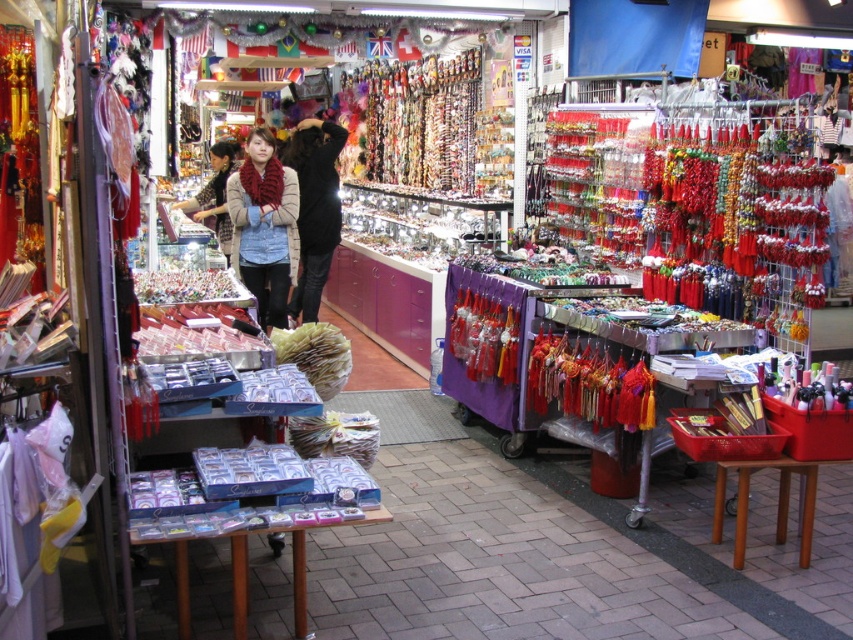
How distant is knitted red scarf at center from velvet scarf at center?

They are 38.79 inches apart.

Can you confirm if knitted red scarf at center is taller than velvet scarf at center?

Incorrect, knitted red scarf at center's height is not larger of velvet scarf at center's.

Locate an element on the screen. This screenshot has height=640, width=853. knitted red scarf at center is located at coordinates (264, 227).

Can you confirm if black matte jacket at center is bigger than velvet scarf at center?

Actually, black matte jacket at center might be smaller than velvet scarf at center.

Looking at this image, who is shorter, black matte jacket at center or velvet scarf at center?

Standing shorter between the two is velvet scarf at center.

Does point (306, 244) come farther from viewer compared to point (225, 260)?

That is True.

This screenshot has width=853, height=640. I want to click on black matte jacket at center, so click(x=314, y=209).

Does knitted red scarf at center appear on the left side of black matte jacket at center?

Correct, you'll find knitted red scarf at center to the left of black matte jacket at center.

Which is in front, point (234, 176) or point (309, 170)?

Point (234, 176) is more forward.

What do you see at coordinates (264, 227) in the screenshot? I see `knitted red scarf at center` at bounding box center [264, 227].

Find the location of a particular element. The width and height of the screenshot is (853, 640). knitted red scarf at center is located at coordinates point(264,227).